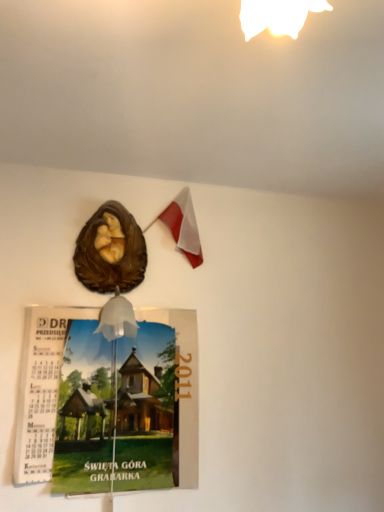
In order to face brown glossy sculpture at upper center, should I rotate leftwards or rightwards?

Rotate your view left by about 10.856°.

What do you see at coordinates (110, 251) in the screenshot? Image resolution: width=384 pixels, height=512 pixels. I see `brown glossy sculpture at upper center` at bounding box center [110, 251].

In order to face polish flag at upper center, should I rotate leftwards or rightwards?

Turn left approximately 2.865 degrees to face it.

Locate an element on the screen. brown glossy sculpture at upper center is located at coordinates (110, 251).

Considering the relative sizes of matte paper calendar at lower left and polish flag at upper center in the image provided, is matte paper calendar at lower left shorter than polish flag at upper center?

In fact, matte paper calendar at lower left may be taller than polish flag at upper center.

From the image's perspective, is matte paper calendar at lower left over polish flag at upper center?

No, from the image's perspective, matte paper calendar at lower left is not on top of polish flag at upper center.

Which is less distant, (x=64, y=384) or (x=195, y=238)?

The point (x=64, y=384) is more forward.

Are matte paper calendar at lower left and polish flag at upper center far apart?

They are positioned close to each other.

Looking at this image, which of these two, brown glossy sculpture at upper center or matte paper calendar at lower left, is wider?

brown glossy sculpture at upper center is wider.

Could matte paper calendar at lower left be considered to be inside brown glossy sculpture at upper center?

Actually, matte paper calendar at lower left is outside brown glossy sculpture at upper center.

Which of these two, brown glossy sculpture at upper center or matte paper calendar at lower left, stands shorter?

brown glossy sculpture at upper center is shorter.

From a real-world perspective, which is physically above, brown glossy sculpture at upper center or matte paper calendar at lower left?

In real-world perspective, brown glossy sculpture at upper center is above.

Consider the image. From the image's perspective, relative to brown glossy sculpture at upper center, is polish flag at upper center above or below?

From the image's perspective, polish flag at upper center appears above brown glossy sculpture at upper center.

Is polish flag at upper center facing towards brown glossy sculpture at upper center?

No, polish flag at upper center does not turn towards brown glossy sculpture at upper center.

Identify the location of flag above the brown glossy sculpture at upper center (from the image's perspective). The image size is (384, 512). (184, 226).

Is polish flag at upper center to the left of brown glossy sculpture at upper center from the viewer's perspective?

Incorrect, polish flag at upper center is not on the left side of brown glossy sculpture at upper center.

Can you confirm if polish flag at upper center is wider than matte paper calendar at lower left?

Correct, the width of polish flag at upper center exceeds that of matte paper calendar at lower left.

Do you think polish flag at upper center is within matte paper calendar at lower left, or outside of it?

polish flag at upper center is not enclosed by matte paper calendar at lower left.

Which object is positioned more to the right, polish flag at upper center or matte paper calendar at lower left?

polish flag at upper center is more to the right.

Find the location of a particular element. magazine in front of the polish flag at upper center is located at coordinates (108, 402).

Is brown glossy sculpture at upper center directly adjacent to polish flag at upper center?

No, brown glossy sculpture at upper center is not with polish flag at upper center.

Who is smaller, brown glossy sculpture at upper center or polish flag at upper center?

polish flag at upper center is smaller.

Is brown glossy sculpture at upper center spatially inside polish flag at upper center, or outside of it?

brown glossy sculpture at upper center is spatially situated outside polish flag at upper center.

Looking at their sizes, would you say brown glossy sculpture at upper center is wider or thinner than polish flag at upper center?

brown glossy sculpture at upper center is wider than polish flag at upper center.

Image resolution: width=384 pixels, height=512 pixels. In order to click on flyer that is on the left side of matte paper calendar at lower left in this screenshot , I will do `click(110, 251)`.

Who is shorter, matte paper calendar at lower left or brown glossy sculpture at upper center?

With less height is brown glossy sculpture at upper center.

Is matte paper calendar at lower left facing away from brown glossy sculpture at upper center?

matte paper calendar at lower left is not turned away from brown glossy sculpture at upper center.

Does matte paper calendar at lower left touch brown glossy sculpture at upper center?

No.

Find the location of a particular element. flag above the matte paper calendar at lower left (from the image's perspective) is located at coordinates (184, 226).

Image resolution: width=384 pixels, height=512 pixels. I want to click on magazine located underneath the brown glossy sculpture at upper center (from a real-world perspective), so click(x=108, y=402).

Based on their spatial positions, is matte paper calendar at lower left or polish flag at upper center further from brown glossy sculpture at upper center?

matte paper calendar at lower left lies further to brown glossy sculpture at upper center than the other object.

Considering their positions, is polish flag at upper center positioned further to matte paper calendar at lower left than brown glossy sculpture at upper center?

Based on the image, polish flag at upper center appears to be further to matte paper calendar at lower left.

Based on their spatial positions, is brown glossy sculpture at upper center or matte paper calendar at lower left further from polish flag at upper center?

matte paper calendar at lower left is further to polish flag at upper center.

Which object lies nearer to the anchor point polish flag at upper center, matte paper calendar at lower left or brown glossy sculpture at upper center?

brown glossy sculpture at upper center is positioned closer to the anchor polish flag at upper center.

In the scene shown: Estimate the real-world distances between objects in this image. Which object is further from brown glossy sculpture at upper center, polish flag at upper center or matte paper calendar at lower left?

The object further to brown glossy sculpture at upper center is matte paper calendar at lower left.

Considering their positions, is brown glossy sculpture at upper center positioned closer to matte paper calendar at lower left than polish flag at upper center?

The object closer to matte paper calendar at lower left is brown glossy sculpture at upper center.

What are the coordinates of `flyer between polish flag at upper center and matte paper calendar at lower left in the up-down direction` in the screenshot? It's located at (110, 251).